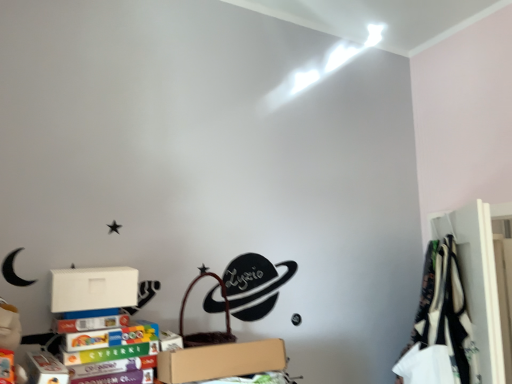
Question: From the image's perspective, would you say white fabric at right is positioned over brown cardboard box at lower center?

Choices:
 (A) yes
 (B) no

Answer: (A)

Question: Is white fabric at right thinner than brown cardboard box at lower center?

Choices:
 (A) no
 (B) yes

Answer: (B)

Question: Would you say white fabric at right is outside brown cardboard box at lower center?

Choices:
 (A) yes
 (B) no

Answer: (A)

Question: Considering the relative positions of white fabric at right and brown cardboard box at lower center in the image provided, is white fabric at right to the left of brown cardboard box at lower center from the viewer's perspective?

Choices:
 (A) no
 (B) yes

Answer: (A)

Question: Is white fabric at right far away from brown cardboard box at lower center?

Choices:
 (A) no
 (B) yes

Answer: (A)

Question: From the image's perspective, is white fabric at right positioned above or below white matte cardboard box at lower left?

Choices:
 (A) above
 (B) below

Answer: (B)

Question: Is white fabric at right situated inside white matte cardboard box at lower left or outside?

Choices:
 (A) inside
 (B) outside

Answer: (B)

Question: In the image, is white fabric at right positioned in front of or behind white matte cardboard box at lower left?

Choices:
 (A) front
 (B) behind

Answer: (B)

Question: Does point coord(490,375) appear closer or farther from the camera than point coord(112,286)?

Choices:
 (A) farther
 (B) closer

Answer: (A)

Question: From the image's perspective, is white matte cardboard box at lower left located above or below white fabric at right?

Choices:
 (A) below
 (B) above

Answer: (B)

Question: Is white matte cardboard box at lower left taller or shorter than white fabric at right?

Choices:
 (A) tall
 (B) short

Answer: (B)

Question: Would you say white matte cardboard box at lower left is inside or outside white fabric at right?

Choices:
 (A) outside
 (B) inside

Answer: (A)

Question: Considering their positions, is white matte cardboard box at lower left located in front of or behind white fabric at right?

Choices:
 (A) front
 (B) behind

Answer: (A)

Question: Is brown cardboard box at lower center to the left or to the right of white matte cardboard box at lower left in the image?

Choices:
 (A) left
 (B) right

Answer: (B)

Question: Is point (178, 362) positioned closer to the camera than point (81, 284)?

Choices:
 (A) closer
 (B) farther

Answer: (A)